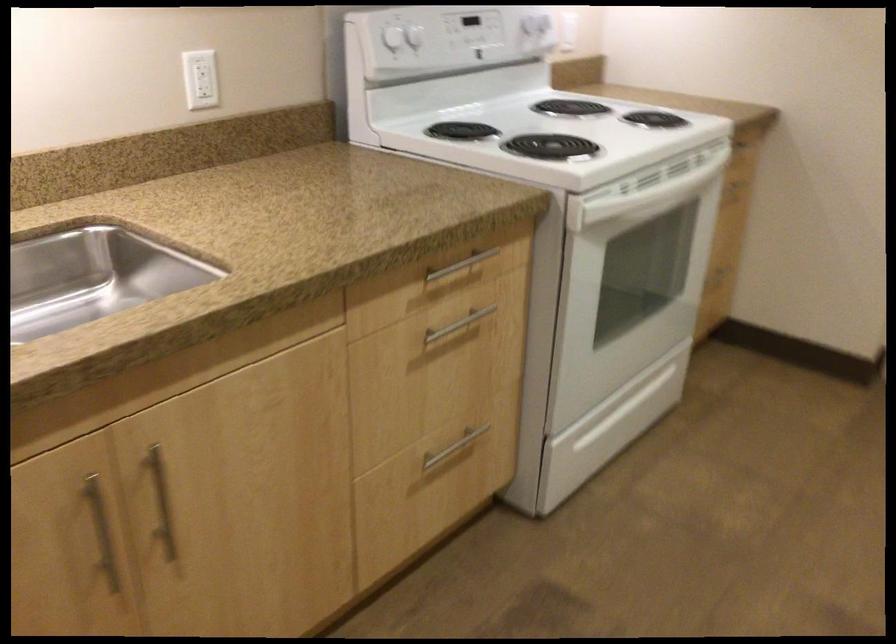
Where would you pull the white oven handle? Please return your answer as a coordinate pair (x, y).

(645, 196)